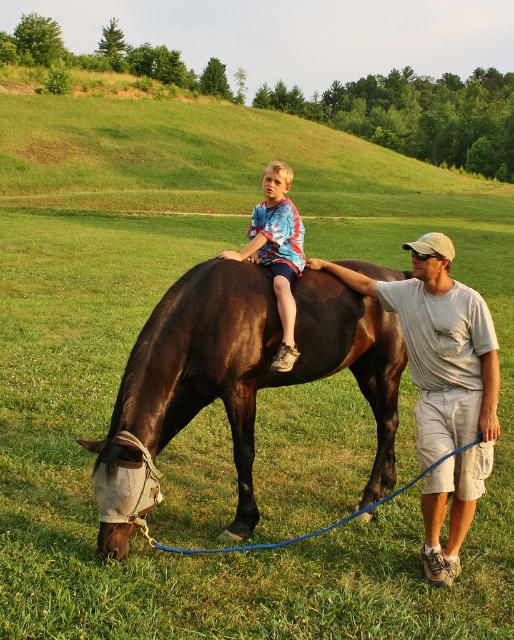
How distant is shiny dark brown horse at center from light gray cotton t-shirt at right?

shiny dark brown horse at center and light gray cotton t-shirt at right are 30.98 inches apart.

Does shiny dark brown horse at center appear over light gray cotton t-shirt at right?

No.

Is point (383, 358) positioned before point (369, 285)?

No, (383, 358) is behind (369, 285).

I want to click on shiny dark brown horse at center, so click(x=248, y=365).

Does shiny dark brown horse at center have a lesser height compared to multicolored tie-dye shirt at center?

Correct, shiny dark brown horse at center is not as tall as multicolored tie-dye shirt at center.

Does point (246, 531) come closer to viewer compared to point (292, 314)?

That is True.

Identify the location of shiny dark brown horse at center. The width and height of the screenshot is (514, 640). (x=248, y=365).

Which is more to the left, light gray cotton t-shirt at right or multicolored tie-dye shirt at center?

From the viewer's perspective, multicolored tie-dye shirt at center appears more on the left side.

Is point (431, 548) behind point (259, 236)?

No, (431, 548) is closer to viewer.

Who is more forward, (409, 330) or (241, 250)?

Point (409, 330)

This screenshot has width=514, height=640. In order to click on light gray cotton t-shirt at right in this screenshot , I will do `click(443, 385)`.